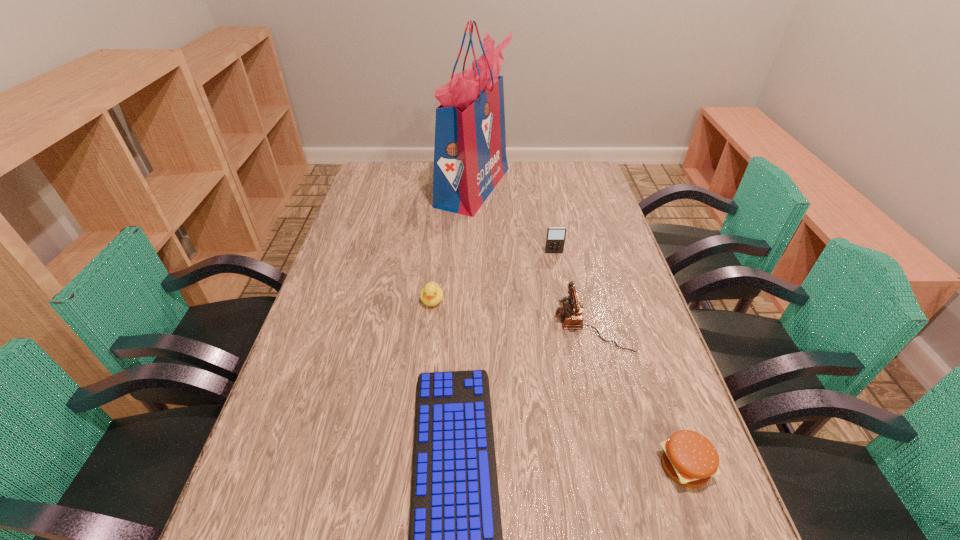
You are a GUI agent. You are given a task and a screenshot of the screen. Output one action in this format:
    pyautogui.click(x=<x>, y=<y>)
    Task: Click on the tallest object
    This screenshot has height=540, width=960.
    Given the screenshot: What is the action you would take?
    pyautogui.click(x=470, y=159)

This screenshot has width=960, height=540. I want to click on grocery bag, so click(470, 159).

This screenshot has width=960, height=540. Find the location of `the fifth nearest object`. the fifth nearest object is located at coordinates (555, 239).

Identify the location of telephone. This screenshot has width=960, height=540. (570, 313).

Find the location of `duckling`. duckling is located at coordinates (431, 294).

At what (x,y) coordinates should I click in order to perform the action: click on hamburger. Please return your answer as a coordinate pair (x, y). The width and height of the screenshot is (960, 540). Looking at the image, I should click on (689, 458).

Find the location of `vacant space located 0.330m on the front-facing side of the farthest object`. vacant space located 0.330m on the front-facing side of the farthest object is located at coordinates (596, 187).

Identify the location of free space located on the front-facing side of the iPod. (556, 264).

You are a GUI agent. You are given a task and a screenshot of the screen. Output one action in this format:
    pyautogui.click(x=<x>, y=<y>)
    Task: Click on the vacant space located 0.130m on the dial of the telephone
    This screenshot has height=540, width=960.
    Given the screenshot: What is the action you would take?
    pyautogui.click(x=507, y=325)

Find the location of a particular element. This screenshot has height=540, width=960. free space located on the dial of the telephone is located at coordinates (462, 325).